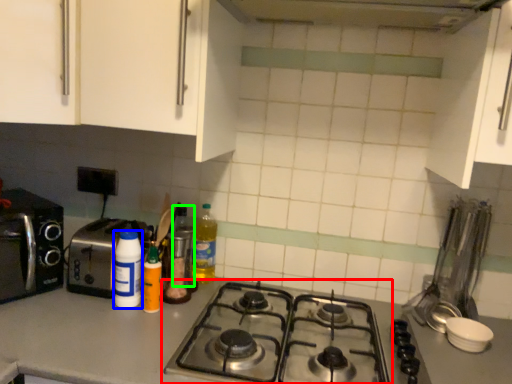
Question: Considering the real-world distances, which object is farthest from gas stove (highlighted by a red box)? bottle (highlighted by a blue box) or bottle (highlighted by a green box)?

Choices:
 (A) bottle
 (B) bottle

Answer: (A)